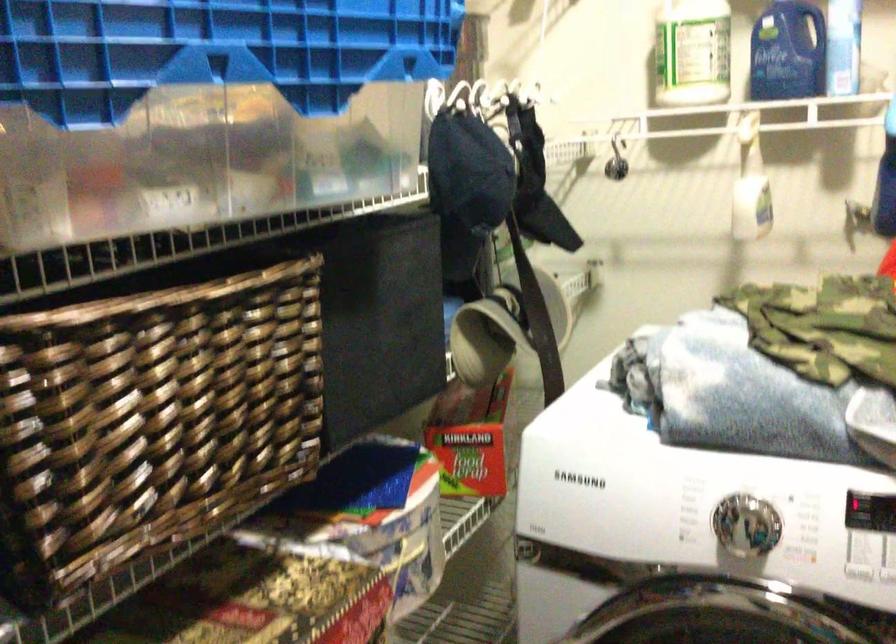
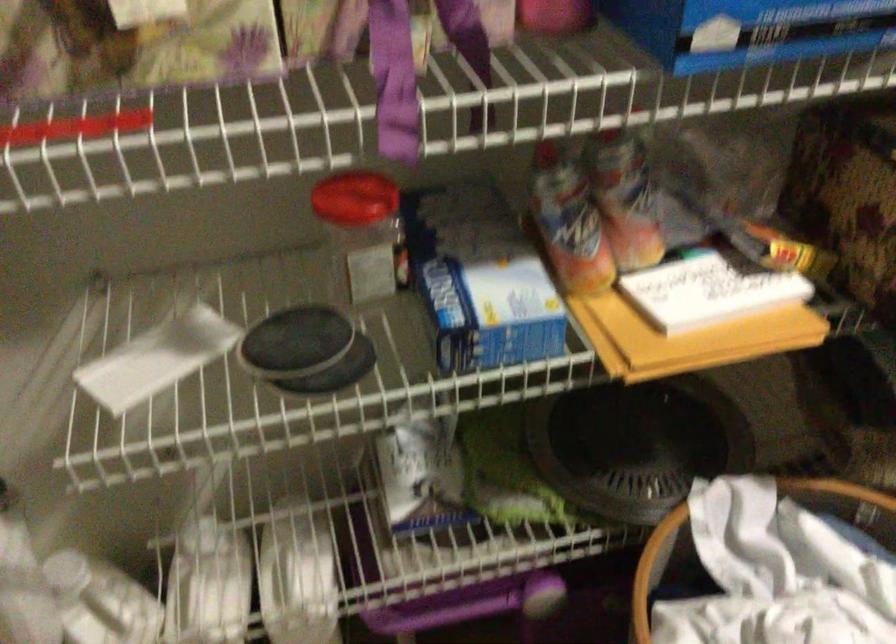
First-person continuous shooting, in which direction is the camera rotating?

The rotation direction of the camera is left-down.